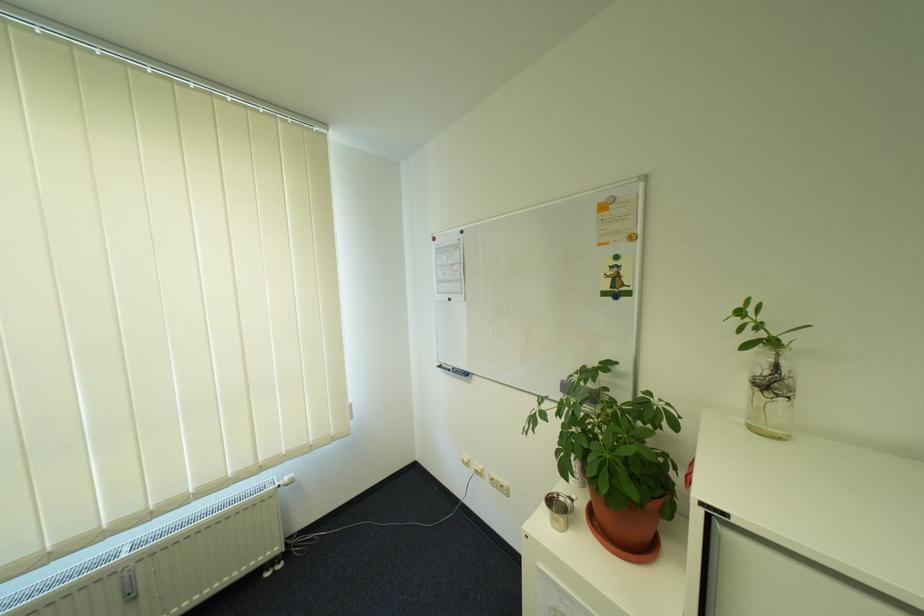
Describe the element at coordinates (572, 499) in the screenshot. I see `a metal cup handle` at that location.